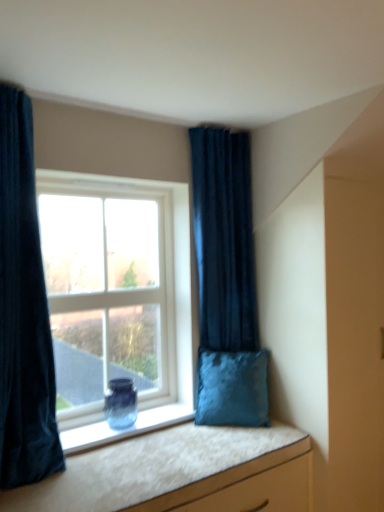
Question: Considering the positions of white textured vanity at lower right and velvet dark blue curtain at left, the 1th curtain viewed from the front, in the image, is white textured vanity at lower right wider or thinner than velvet dark blue curtain at left, the 1th curtain viewed from the front,?

Choices:
 (A) wide
 (B) thin

Answer: (A)

Question: Considering the positions of white textured vanity at lower right and velvet dark blue curtain at left, acting as the first curtain starting from the left, in the image, is white textured vanity at lower right bigger or smaller than velvet dark blue curtain at left, acting as the first curtain starting from the left,?

Choices:
 (A) small
 (B) big

Answer: (A)

Question: Which is nearer to the white textured vanity at lower right?

Choices:
 (A) velvet dark blue curtain at left, placed as the second curtain when sorted from right to left
 (B) velvety blue cushion at right
 (C) clear glass window at center
 (D) blue glass vase at window
 (E) velvet dark blue curtain at upper right, which ranks as the 1th curtain in back-to-front order

Answer: (B)

Question: Which object is the farthest from the white textured vanity at lower right?

Choices:
 (A) clear glass window at center
 (B) velvety blue cushion at right
 (C) velvet dark blue curtain at upper right, which ranks as the 1th curtain in back-to-front order
 (D) velvet dark blue curtain at left, placed as the second curtain when sorted from right to left
 (E) blue glass vase at window

Answer: (C)